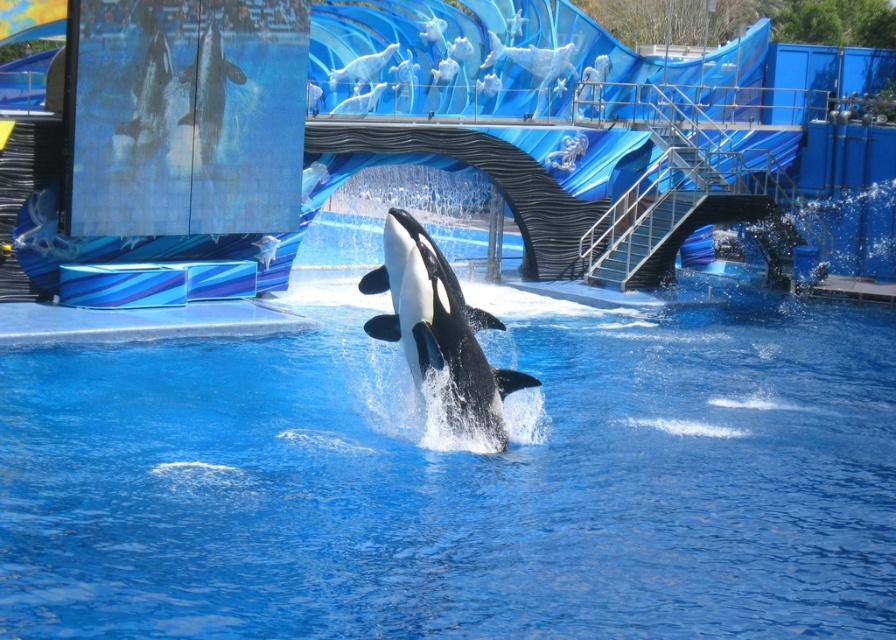
You are a marine biologist observing the orca in the marine park. You notice a point marked at coordinates (461, 481) on your observation chart. Based on the scene, what does this point likely represent?

The point marked at coordinates (461, 481) likely represents the blue smooth water at center, as the orca is leaping out of this area, creating splashes around it.

You are a marine biologist observing the marine park scene. You need to determine which object occupies more space in the image. Based on the scene, which is larger between the blue smooth water at center and the black smooth dolphin at upper left?

The blue smooth water at center is larger in size than the black smooth dolphin at upper left, so the blue smooth water at center occupies more space in the image.

You are a marine biologist observing the marine park scene. You need to determine which object occupies a higher position in the image. Which one is higher between the blue smooth water at center and the black smooth dolphin at upper left?

The black smooth dolphin at upper left is positioned higher than the blue smooth water at center.